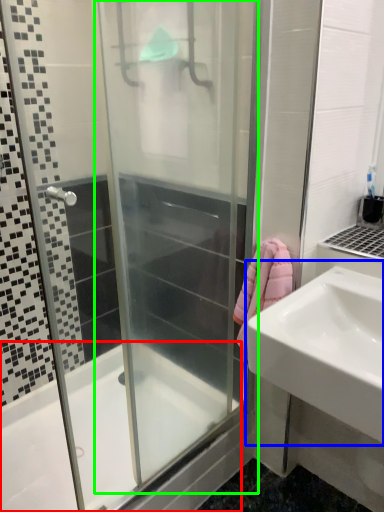
Question: Based on their relative distances, which object is farther from bathtub (highlighted by a red box)? Choose from sink (highlighted by a blue box) and screen door (highlighted by a green box).

Choices:
 (A) sink
 (B) screen door

Answer: (A)